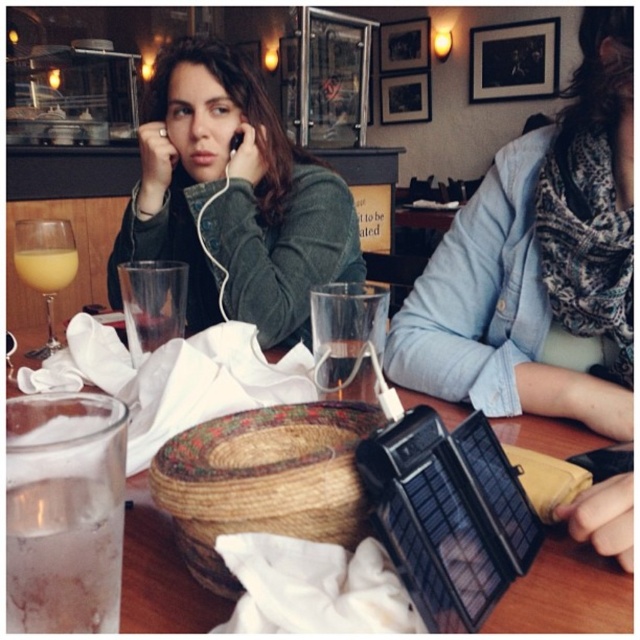
Question: Does yellow liquid at upper left have a greater width compared to black matte earphone at upper center?

Choices:
 (A) yes
 (B) no

Answer: (A)

Question: Which is farther from the green fuzzy sweater at upper center?

Choices:
 (A) translucent glass at center
 (B) black matte earphone at upper center

Answer: (A)

Question: Does green fuzzy sweater at upper center appear over yellow liquid at upper left?

Choices:
 (A) no
 (B) yes

Answer: (B)

Question: Which point is farther from the camera taking this photo?

Choices:
 (A) (211, 272)
 (B) (564, 547)

Answer: (A)

Question: From the image, what is the correct spatial relationship of green fuzzy sweater at upper center in relation to wooden table at center?

Choices:
 (A) right
 (B) left

Answer: (B)

Question: Among these points, which one is farthest from the camera?

Choices:
 (A) (376, 396)
 (B) (502, 424)
 (C) (230, 150)
 (D) (150, 184)

Answer: (D)